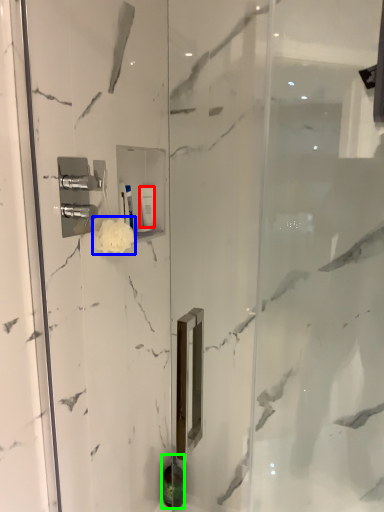
Question: Based on their relative distances, which object is farther from toiletry (highlighted by a red box)? Choose from flower (highlighted by a blue box) and toiletry (highlighted by a green box).

Choices:
 (A) flower
 (B) toiletry

Answer: (B)